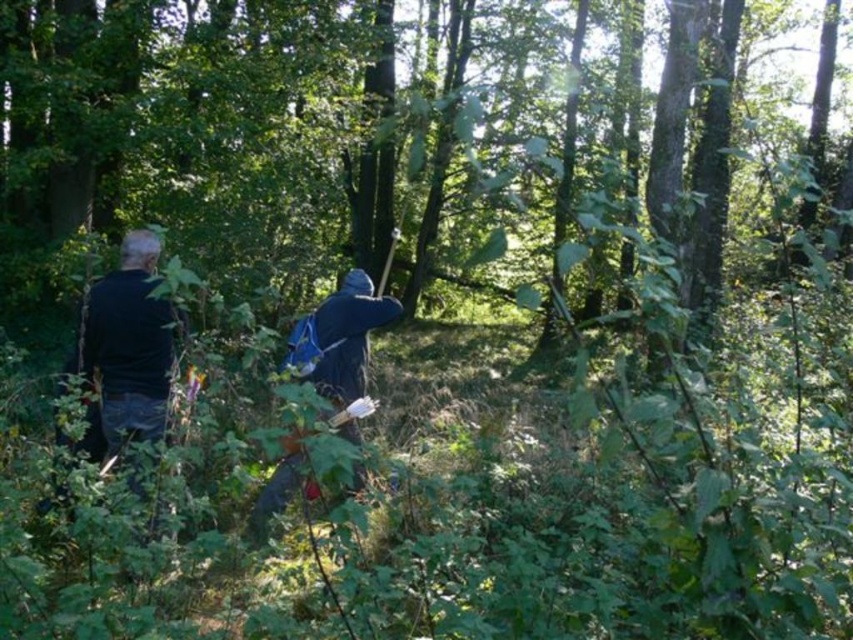
Question: Is black matte jacket at left positioned behind dark blue hooded cloak at center?

Choices:
 (A) no
 (B) yes

Answer: (A)

Question: Is the position of black matte jacket at left more distant than that of dark blue hooded cloak at center?

Choices:
 (A) no
 (B) yes

Answer: (A)

Question: Among these objects, which one is farthest from the camera?

Choices:
 (A) dark blue hooded cloak at center
 (B) black matte jacket at left

Answer: (A)

Question: Which point is closer to the camera?

Choices:
 (A) (103, 365)
 (B) (320, 339)

Answer: (A)

Question: Can you confirm if black matte jacket at left is positioned below dark blue hooded cloak at center?

Choices:
 (A) yes
 (B) no

Answer: (B)